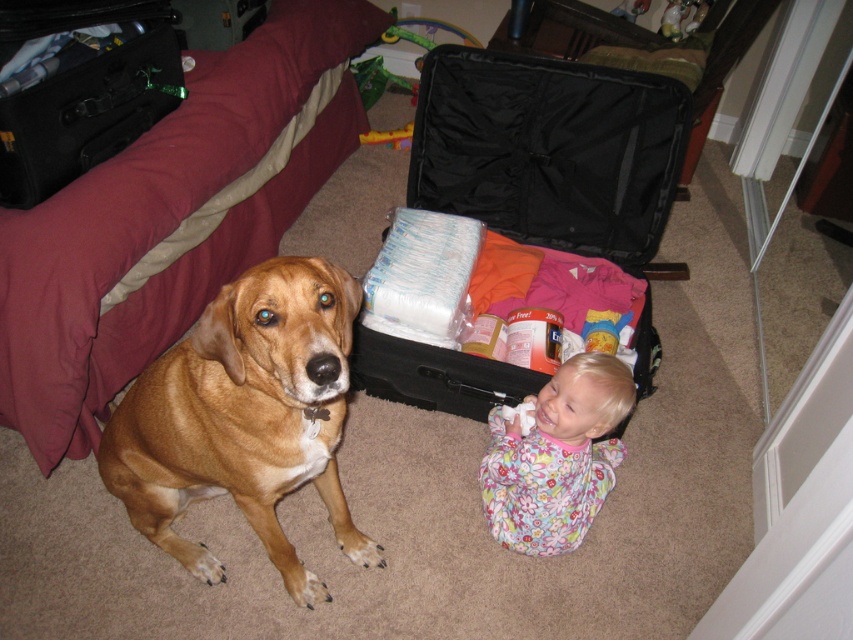
You are a parent trying to pack the black fabric suitcase at center and the floral fabric baby at center into a car trunk. The trunk has limited space. Based on their positions in the image, which item is easier to move first?

The black fabric suitcase at center is positioned over floral fabric baby at center, so you should move the floral fabric baby at center first to access the suitcase underneath.

You are standing in the room and want to place a small toy between the two points, point (x=495, y=188) and point (x=265, y=275). Which point is closer to you so that you can reach it first?

Point (x=495, y=188) is further to the viewer than point (x=265, y=275), so the point closer to you is point (x=265, y=275). You can reach it first.